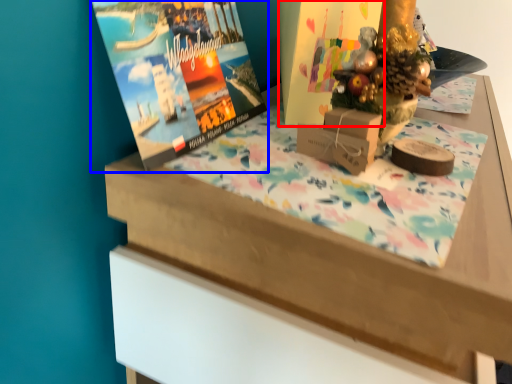
Question: Which object is closer to the camera taking this photo, book cover (highlighted by a red box) or magazine (highlighted by a blue box)?

Choices:
 (A) book cover
 (B) magazine

Answer: (B)